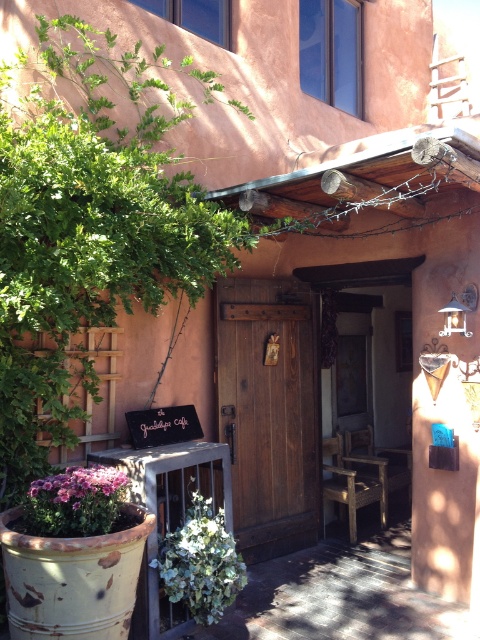
Question: Does green leafy plant at lower center appear on the left side of purple matte flowers at lower left?

Choices:
 (A) yes
 (B) no

Answer: (B)

Question: Which of the following is the farthest from the observer?

Choices:
 (A) (286, 538)
 (B) (94, 488)

Answer: (A)

Question: Which point is farther from the camera taking this photo?

Choices:
 (A) coord(238,486)
 (B) coord(229,596)
 (C) coord(100,499)

Answer: (A)

Question: Is rustic wood door at center closer to the viewer compared to purple matte flowers at lower left?

Choices:
 (A) yes
 (B) no

Answer: (B)

Question: Which is nearer to the rustic wood door at center?

Choices:
 (A) green leafy plant at lower center
 (B) purple matte flowers at lower left

Answer: (A)

Question: Does rustic wood door at center appear under green leafy plant at lower center?

Choices:
 (A) yes
 (B) no

Answer: (B)